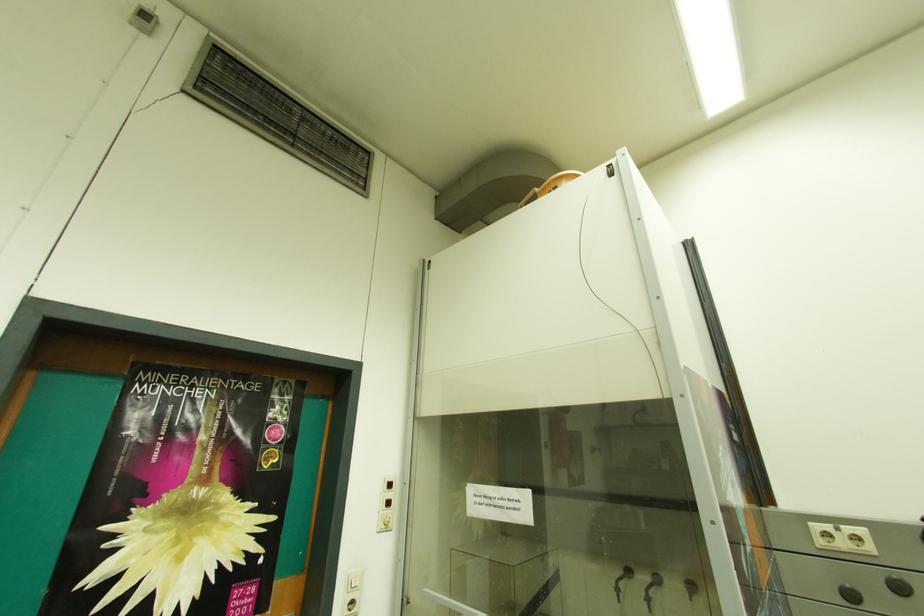
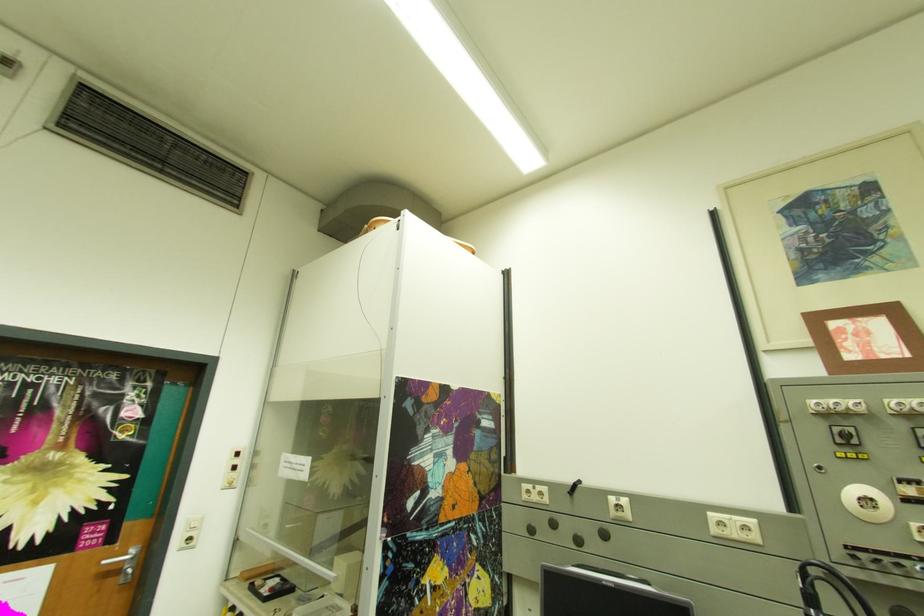
Which direction would the cameraman need to move to produce the second image?

The movement direction of the cameraman is right, backward.